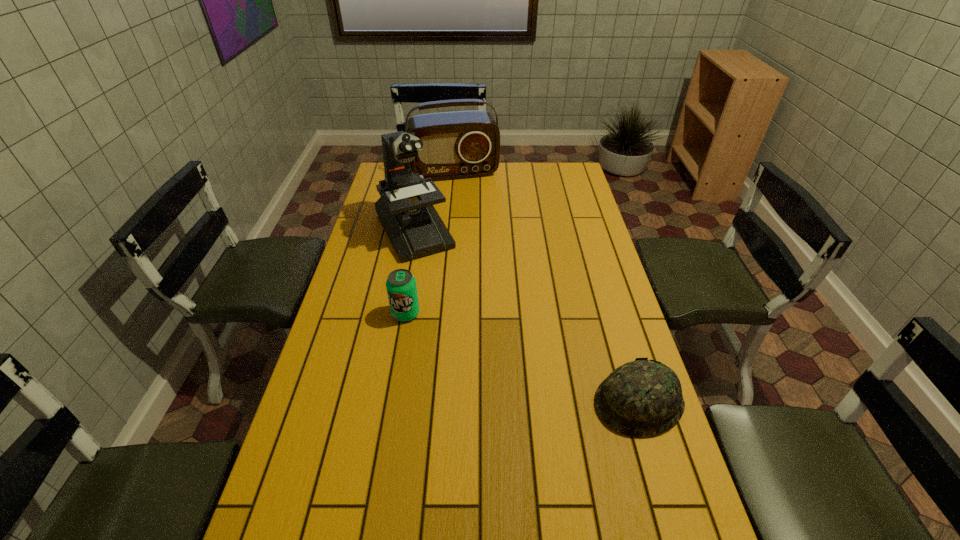
You are a GUI agent. You are given a task and a screenshot of the screen. Output one action in this format:
    pyautogui.click(x=<x>, y=<y>)
    Task: Click on the free area in between the microscope and the rightmost object
    
    Given the screenshot: What is the action you would take?
    pyautogui.click(x=526, y=316)

The height and width of the screenshot is (540, 960). I want to click on free space between the microscope and the rightmost object, so click(x=526, y=316).

The image size is (960, 540). Find the location of `free spot between the pop soda and the nearest object`. free spot between the pop soda and the nearest object is located at coordinates [522, 358].

Point out which object is positioned as the nearest to the third shortest object. Please provide its 2D coordinates. Your answer should be formatted as a tuple, i.e. [(x, y)], where the tuple contains the x and y coordinates of a point satisfying the conditions above.

[(405, 209)]

This screenshot has width=960, height=540. In order to click on object that is the nearest to the second tallest object in this screenshot , I will do `click(405, 209)`.

Locate an element on the screen. This screenshot has width=960, height=540. free space that satisfies the following two spatial constraints: 1. on the front-facing side of the third tallest object; 2. on the left side of the shortest object is located at coordinates (391, 402).

You are a GUI agent. You are given a task and a screenshot of the screen. Output one action in this format:
    pyautogui.click(x=<x>, y=<y>)
    Task: Click on the free point that satisfies the following two spatial constraints: 1. on the back side of the second farthest object; 2. on the left side of the radio receiver
    The width and height of the screenshot is (960, 540).
    Given the screenshot: What is the action you would take?
    pyautogui.click(x=425, y=173)